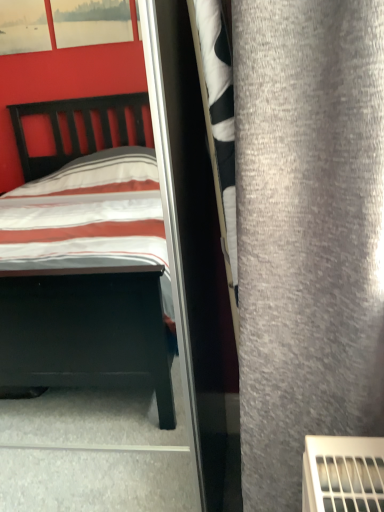
Identify the location of striped fabric bed at left. Image resolution: width=384 pixels, height=512 pixels. (88, 256).

The image size is (384, 512). Identify the location of clear glass screen door at center. (194, 252).

Identify the location of striped fabric bed at left. The image size is (384, 512). (88, 256).

Is gray fabric curtain at right positioned behind striped fabric bed at left?

No, it is in front of striped fabric bed at left.

Is gray fabric curtain at right not near striped fabric bed at left?

Indeed, gray fabric curtain at right is not near striped fabric bed at left.

Does gray fabric curtain at right have a larger size compared to striped fabric bed at left?

Incorrect, gray fabric curtain at right is not larger than striped fabric bed at left.

Find the location of a particular element. The image size is (384, 512). bed behind the gray fabric curtain at right is located at coordinates (88, 256).

Between point (193, 451) and point (238, 186), which one is positioned behind?

The point (193, 451) is more distant.

Consider the image. Is clear glass screen door at center with gray fabric curtain at right?

No, clear glass screen door at center is not touching gray fabric curtain at right.

Locate an element on the screen. screen door below the gray fabric curtain at right (from a real-world perspective) is located at coordinates (194, 252).

From the image's perspective, which one is positioned lower, clear glass screen door at center or gray fabric curtain at right?

clear glass screen door at center, from the image's perspective.

Which of these two, clear glass screen door at center or striped fabric bed at left, is bigger?

With larger size is striped fabric bed at left.

Is clear glass screen door at center turned away from striped fabric bed at left?

No.

Looking at this image, would you consider clear glass screen door at center to be distant from striped fabric bed at left?

Actually, clear glass screen door at center and striped fabric bed at left are a little close together.

Based on the photo, considering the positions of objects gray fabric curtain at right and clear glass screen door at center in the image provided, who is more to the right, gray fabric curtain at right or clear glass screen door at center?

gray fabric curtain at right is more to the right.

Is gray fabric curtain at right not close to clear glass screen door at center?

No, gray fabric curtain at right is not far from clear glass screen door at center.

Consider the image. Which object is further away from the camera taking this photo, gray fabric curtain at right or clear glass screen door at center?

clear glass screen door at center is further away from the camera.

How far apart are gray fabric curtain at right and clear glass screen door at center?

gray fabric curtain at right and clear glass screen door at center are 11.48 inches apart.

Between striped fabric bed at left and clear glass screen door at center, which one is positioned in front?

striped fabric bed at left.

Considering the relative sizes of striped fabric bed at left and clear glass screen door at center in the image provided, is striped fabric bed at left wider than clear glass screen door at center?

Yes.

Image resolution: width=384 pixels, height=512 pixels. Find the location of `screen door above the striped fabric bed at left (from a real-world perspective)`. screen door above the striped fabric bed at left (from a real-world perspective) is located at coordinates (194, 252).

Considering the sizes of striped fabric bed at left and gray fabric curtain at right in the image, is striped fabric bed at left taller or shorter than gray fabric curtain at right?

In the image, striped fabric bed at left appears to be taller than gray fabric curtain at right.

Between point (129, 384) and point (326, 93), which one is positioned in front?

The point (326, 93) is more forward.

Measure the distance from striped fabric bed at left to gray fabric curtain at right.

striped fabric bed at left is 1.35 meters away from gray fabric curtain at right.

I want to click on bed directly beneath the gray fabric curtain at right (from a real-world perspective), so click(x=88, y=256).

Where is `curtain above the clear glass screen door at center (from a real-world perspective)`? The image size is (384, 512). curtain above the clear glass screen door at center (from a real-world perspective) is located at coordinates (307, 232).

Based on their spatial positions, is gray fabric curtain at right or clear glass screen door at center further from striped fabric bed at left?

gray fabric curtain at right.

When comparing their distances from striped fabric bed at left, does clear glass screen door at center or gray fabric curtain at right seem closer?

clear glass screen door at center lies closer to striped fabric bed at left than the other object.

Considering their positions, is clear glass screen door at center positioned further to gray fabric curtain at right than striped fabric bed at left?

Based on the image, striped fabric bed at left appears to be further to gray fabric curtain at right.

Based on their spatial positions, is gray fabric curtain at right or striped fabric bed at left further from clear glass screen door at center?

striped fabric bed at left is positioned further to the anchor clear glass screen door at center.

Based on their spatial positions, is striped fabric bed at left or gray fabric curtain at right further from clear glass screen door at center?

striped fabric bed at left lies further to clear glass screen door at center than the other object.

When comparing their distances from gray fabric curtain at right, does striped fabric bed at left or clear glass screen door at center seem closer?

clear glass screen door at center is closer to gray fabric curtain at right.

Where is `screen door located between striped fabric bed at left and gray fabric curtain at right in the left-right direction`? Image resolution: width=384 pixels, height=512 pixels. screen door located between striped fabric bed at left and gray fabric curtain at right in the left-right direction is located at coordinates (194, 252).